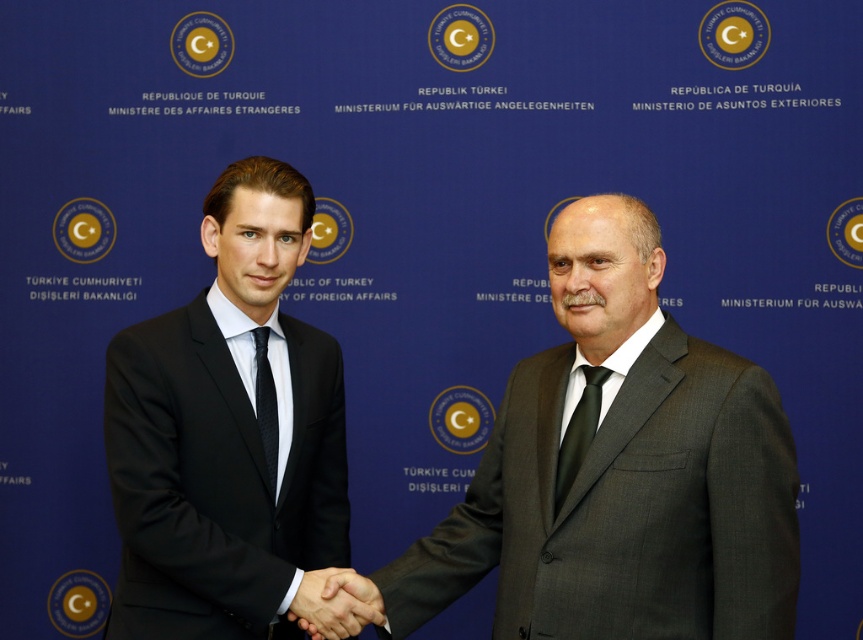
Question: Based on their relative distances, which object is farther from the dark gray suit at center?

Choices:
 (A) smooth leather hand at center
 (B) matte black tie at right
 (C) black suit at left
 (D) black textured tie at center

Answer: (D)

Question: Among these objects, which one is farthest from the camera?

Choices:
 (A) black suit at left
 (B) dark gray suit at center

Answer: (A)

Question: Does black suit at left appear on the right side of matte black tie at right?

Choices:
 (A) yes
 (B) no

Answer: (B)

Question: Does matte black tie at right have a larger size compared to black textured tie at center?

Choices:
 (A) no
 (B) yes

Answer: (B)

Question: Can you confirm if dark gray suit at center is bigger than black suit at left?

Choices:
 (A) no
 (B) yes

Answer: (B)

Question: Which object is closer to the camera taking this photo?

Choices:
 (A) black suit at left
 (B) smooth leather hand at center
 (C) dark gray suit at center

Answer: (C)